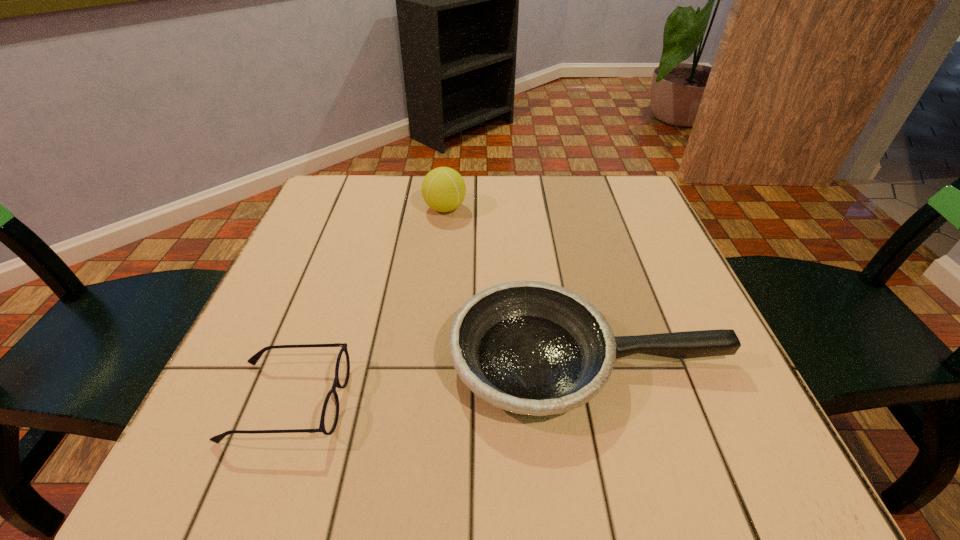
You are a GUI agent. You are given a task and a screenshot of the screen. Output one action in this format:
    pyautogui.click(x=<x>, y=<y>)
    Task: Click on the object at the right edge
    
    Given the screenshot: What is the action you would take?
    pyautogui.click(x=533, y=348)

You are a GUI agent. You are given a task and a screenshot of the screen. Output one action in this format:
    pyautogui.click(x=<x>, y=<y>)
    Task: Click on the object that is at the near left corner
    This screenshot has width=960, height=540.
    Given the screenshot: What is the action you would take?
    [x=330, y=412]

Find the location of a particular element. The height and width of the screenshot is (540, 960). object that is at the near right corner is located at coordinates (533, 348).

In order to click on vacant area at the far edge of the desktop in this screenshot , I will do `click(413, 224)`.

In the image, there is a desktop. What are the coordinates of `free region at the near edge` in the screenshot? It's located at (552, 461).

Where is `free space at the left edge of the desktop`? The width and height of the screenshot is (960, 540). free space at the left edge of the desktop is located at coordinates (326, 237).

In the image, there is a desktop. What are the coordinates of `free space at the right edge` in the screenshot? It's located at (675, 283).

This screenshot has height=540, width=960. What are the coordinates of `vacant region at the far left corner of the desktop` in the screenshot? It's located at (360, 218).

Find the location of a particular element. Image resolution: width=960 pixels, height=540 pixels. vacant region at the far right corner is located at coordinates point(623,177).

Identify the location of vacant region at the near right corner. (708, 435).